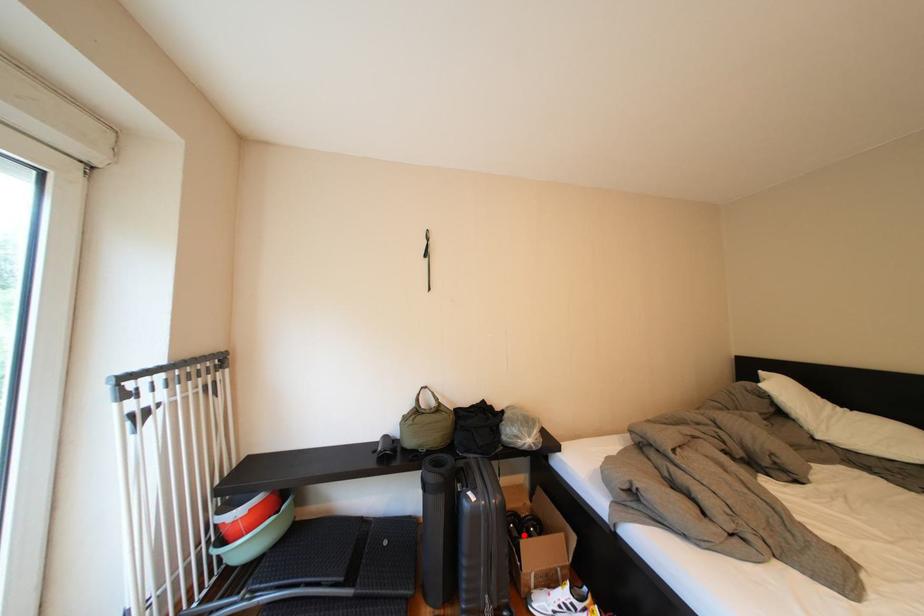
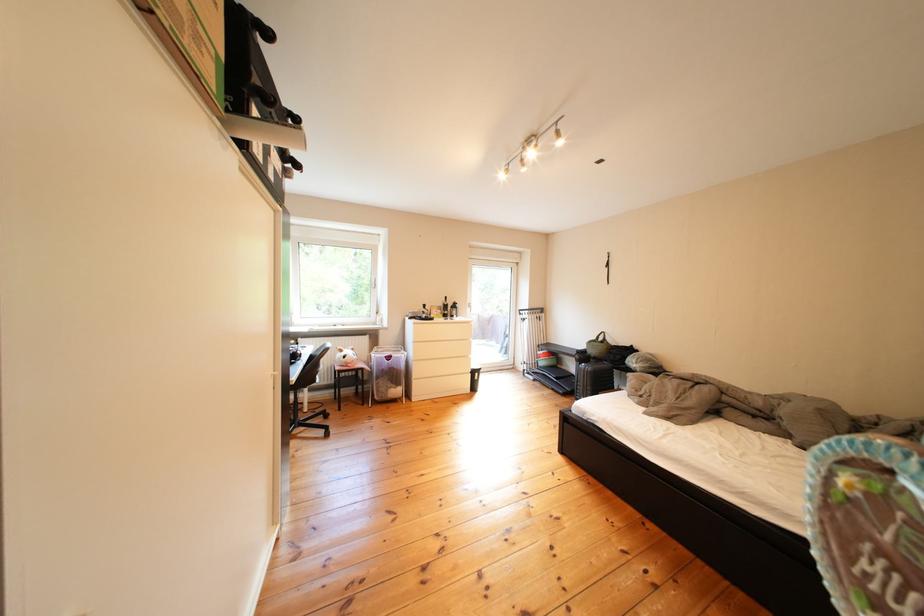
Question: I am providing you with two images of the same scene from different viewpoints. A red point is marked on the first image. Can you still see the location of the red point in image 2?

Choices:
 (A) Yes
 (B) No

Answer: (B)